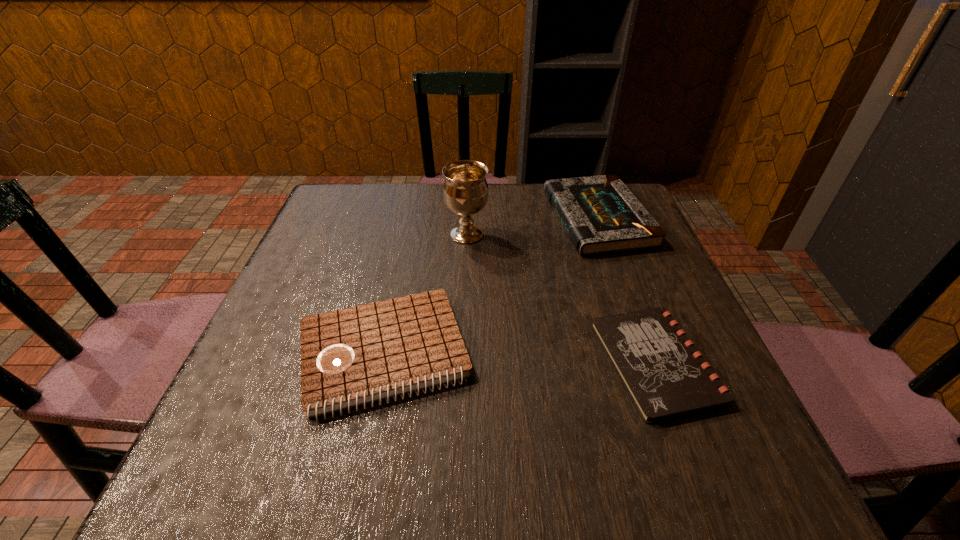
Locate an element on the screen. The image size is (960, 540). vacant area that lies between the shortest object and the second tallest object is located at coordinates (626, 291).

Find the location of a particular element. The width and height of the screenshot is (960, 540). blank region between the shortest object and the tallest notebook is located at coordinates (626, 291).

Locate an element on the screen. The height and width of the screenshot is (540, 960). unoccupied area between the shortest object and the second shortest notebook is located at coordinates (519, 359).

The image size is (960, 540). Find the location of `vacant region between the shortest object and the tallest object`. vacant region between the shortest object and the tallest object is located at coordinates (561, 299).

Locate an element on the screen. The image size is (960, 540). free space between the second tallest object and the shortest object is located at coordinates (626, 291).

Image resolution: width=960 pixels, height=540 pixels. In order to click on blank region between the farthest notebook and the tallest object in this screenshot , I will do `click(532, 227)`.

The image size is (960, 540). Identify the location of free space between the chalice and the shortest notebook. (561, 299).

Identify the location of free spot between the tallest notebook and the leftmost notebook. This screenshot has height=540, width=960. (491, 286).

Image resolution: width=960 pixels, height=540 pixels. Find the location of `object that stands as the second closest to the leftmost notebook`. object that stands as the second closest to the leftmost notebook is located at coordinates (665, 376).

You are a GUI agent. You are given a task and a screenshot of the screen. Output one action in this format:
    pyautogui.click(x=<x>, y=<y>)
    Task: Click on the closest object to the chalice
    The image size is (960, 540).
    Given the screenshot: What is the action you would take?
    601,215